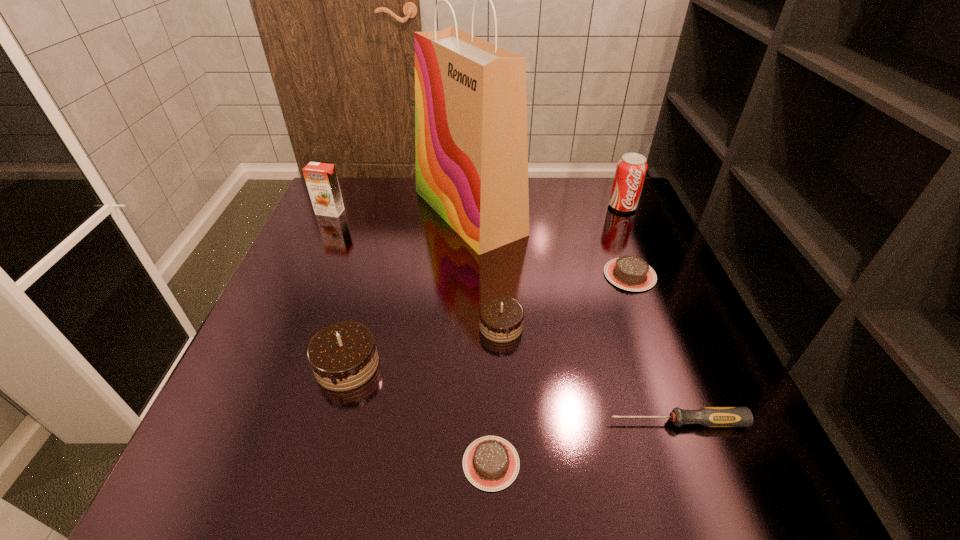
The image size is (960, 540). In order to click on shopping bag in this screenshot , I will do `click(471, 149)`.

This screenshot has height=540, width=960. Identify the location of soda can. (631, 169).

Locate an element on the screen. The height and width of the screenshot is (540, 960). orange orange juice is located at coordinates (321, 179).

You are a GUI agent. You are given a task and a screenshot of the screen. Output one action in this format:
    pyautogui.click(x=<x>, y=<y>)
    Task: Click on the orange juice
    This screenshot has width=960, height=540.
    Given the screenshot: What is the action you would take?
    pyautogui.click(x=321, y=179)

Locate an element on the screen. The height and width of the screenshot is (540, 960). the seventh object from right to left is located at coordinates (343, 356).

Find the location of a particular element. This screenshot has height=540, width=960. the leftmost chocolate cake is located at coordinates pos(343,356).

I want to click on the smaller chocolate chocolate cake, so click(x=501, y=318).

Locate an element on the screen. the right chocolate chocolate cake is located at coordinates (501, 318).

At what (x,y) coordinates should I click in order to perform the action: click on the seventh farthest object. Please return your answer as a coordinate pair (x, y). Looking at the image, I should click on (708, 416).

Where is `the fourth farthest object`? Image resolution: width=960 pixels, height=540 pixels. the fourth farthest object is located at coordinates (631, 273).